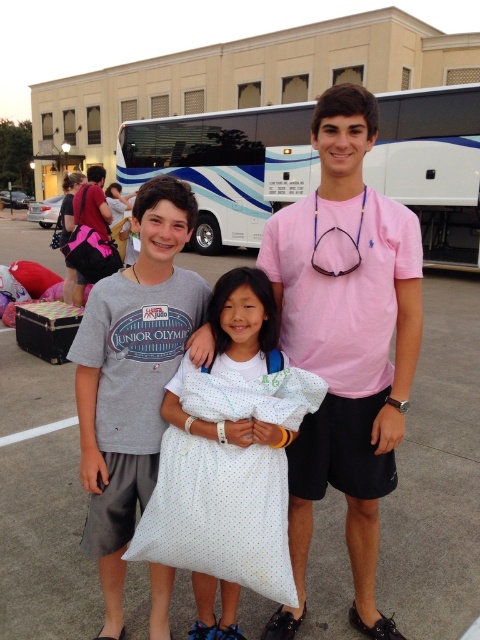
Can you confirm if gray cotton t-shirt at center is positioned to the right of matte gray t-shirt at center?

Indeed, gray cotton t-shirt at center is positioned on the right side of matte gray t-shirt at center.

Between point (115, 509) and point (96, 195), which one is positioned behind?

Positioned behind is point (96, 195).

In the scene shown: Who is more forward, (108,509) or (92,195)?

Point (108,509)

At what (x,y) coordinates should I click in order to perform the action: click on gray cotton t-shirt at center. Please return your answer as a coordinate pair (x, y). Looking at the image, I should click on (133, 376).

I want to click on white dotted fabric bag at center, so click(196, 541).

The height and width of the screenshot is (640, 480). Identify the location of white dotted fabric bag at center. (196, 541).

Between pink cotton t-shirt at center and gray cotton t-shirt at center, which one appears on the left side from the viewer's perspective?

Positioned to the left is gray cotton t-shirt at center.

Is pink cotton t-shirt at center shorter than gray cotton t-shirt at center?

No.

Is point (347, 252) more distant than point (206, 326)?

No, it is in front of (206, 326).

Where is `pink cotton t-shirt at center`? Image resolution: width=480 pixels, height=640 pixels. pink cotton t-shirt at center is located at coordinates (346, 342).